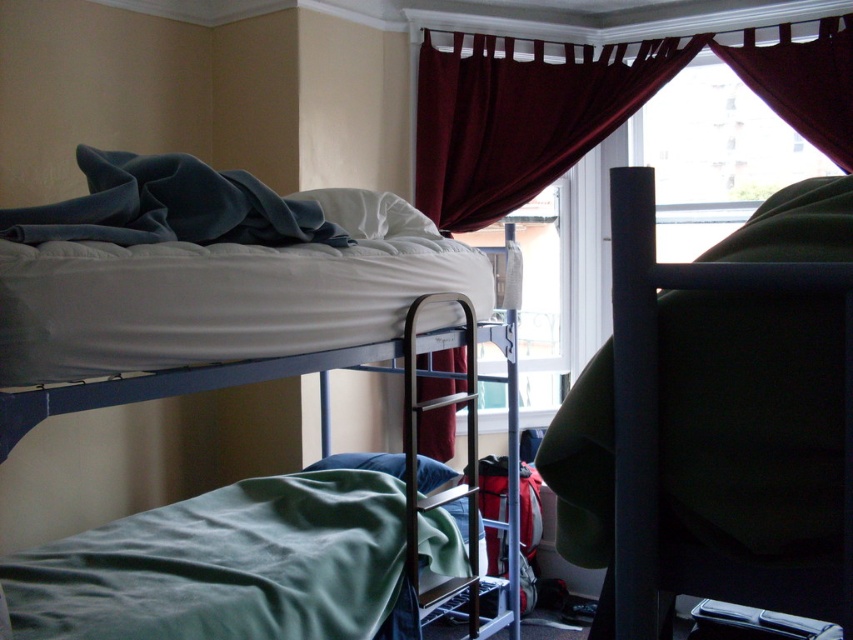
You are a parent trying to place a new nightstand between the white matte bunk bed at upper left and the blue blanket on the upper bed. The nightstand is 1.5 meters wide. Can it fit in the space between them?

The distance between the white matte bunk bed at upper left and the blue blanket on the upper bed is 1.64 meters. Since the nightstand is 1.5 meters wide, it can fit in the space between them as there is enough room.

You are trying to decide whether the blue fleece blanket at upper left can cover the green fabric pillow at lower center completely. Based on their sizes, is this possible?

The blue fleece blanket at upper left might be wider than green fabric pillow at lower center, so it could potentially cover it completely depending on the exact dimensions.

You are trying to place a new rectangular storage box that is 2 feet wide between the white matte bunk bed at upper left and the green fabric pillow at lower center. Based on their widths, can you determine if the box will fit without overlapping either object?

The white matte bunk bed at upper left might be wider than the green fabric pillow at lower center, so the storage box that is 2 feet wide may or may not fit depending on the exact width of the bunk bed. Without precise measurements, it is uncertain.